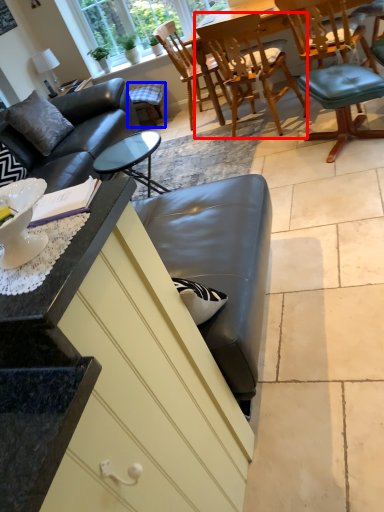
Question: Among these objects, which one is farthest to the camera, chair (highlighted by a red box) or bar stool (highlighted by a blue box)?

Choices:
 (A) chair
 (B) bar stool

Answer: (B)